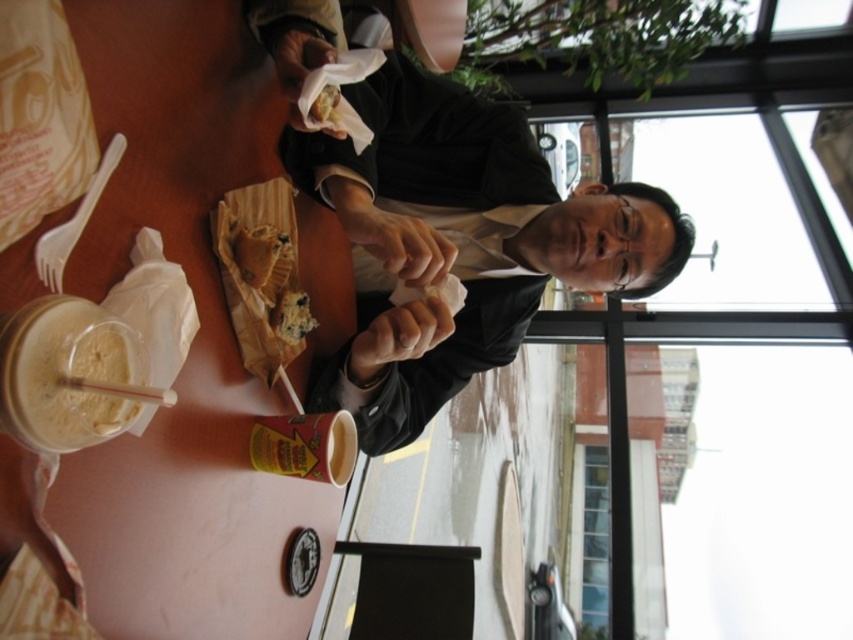
Question: Among these objects, which one is farthest from the camera?

Choices:
 (A) chocolate chip muffin at center
 (B) white creamy smoothie at lower left

Answer: (A)

Question: Is smooth brown table at center to the right of chocolate chip muffin at center from the viewer's perspective?

Choices:
 (A) yes
 (B) no

Answer: (B)

Question: From the image, what is the correct spatial relationship of matte black jacket at center in relation to chocolate chip cookie at center?

Choices:
 (A) below
 (B) above

Answer: (B)

Question: Which of the following is the farthest from the observer?

Choices:
 (A) smooth brown table at center
 (B) matte black jacket at center

Answer: (B)

Question: Can you confirm if white creamy smoothie at lower left is thinner than chocolate chip muffin at center?

Choices:
 (A) no
 (B) yes

Answer: (A)

Question: Estimate the real-world distances between objects in this image. Which object is closer to the chocolate chip muffin at center?

Choices:
 (A) smooth brown table at center
 (B) chocolate chip cookie at center

Answer: (B)